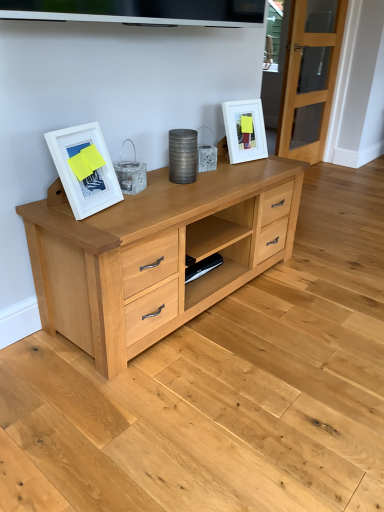
Identify the location of free space in front of clear glass door at right. Image resolution: width=384 pixels, height=512 pixels. (323, 189).